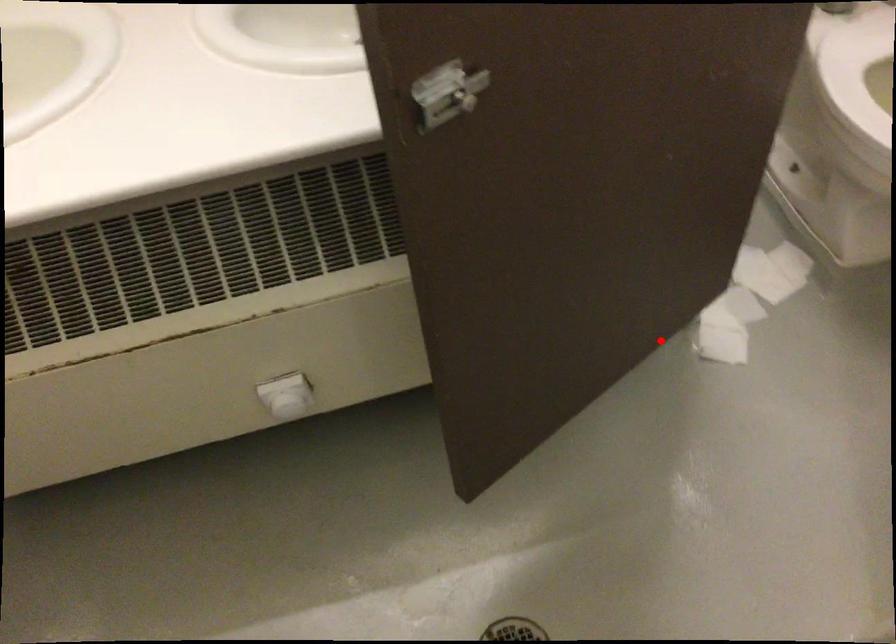
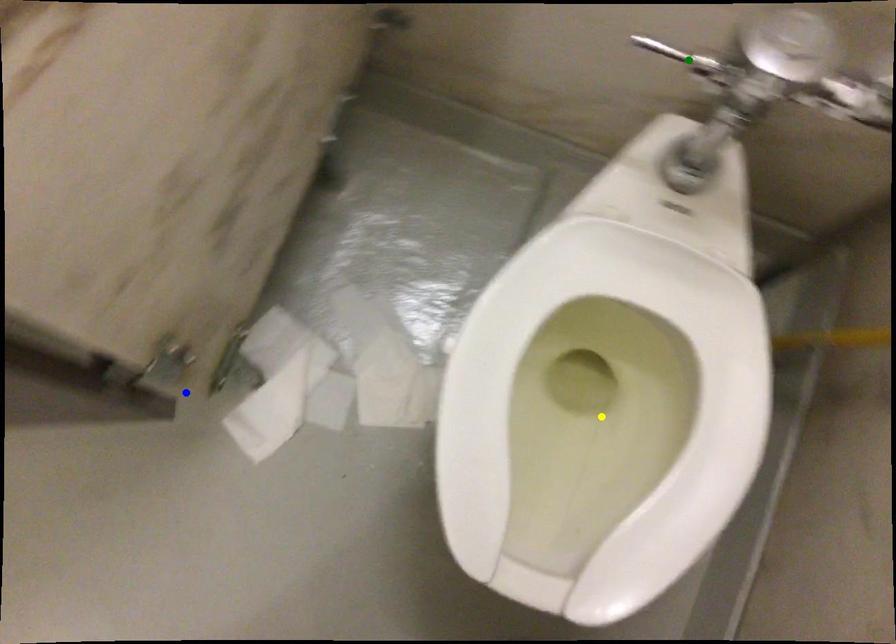
Question: I am providing you with two images of the same scene from different viewpoints. A red point is marked on the first image. You are given multiple points on the second image. Can you choose the point in image 2 that corresponds to the point in image 1?

Choices:
 (A) yellow point
 (B) green point
 (C) blue point

Answer: (C)